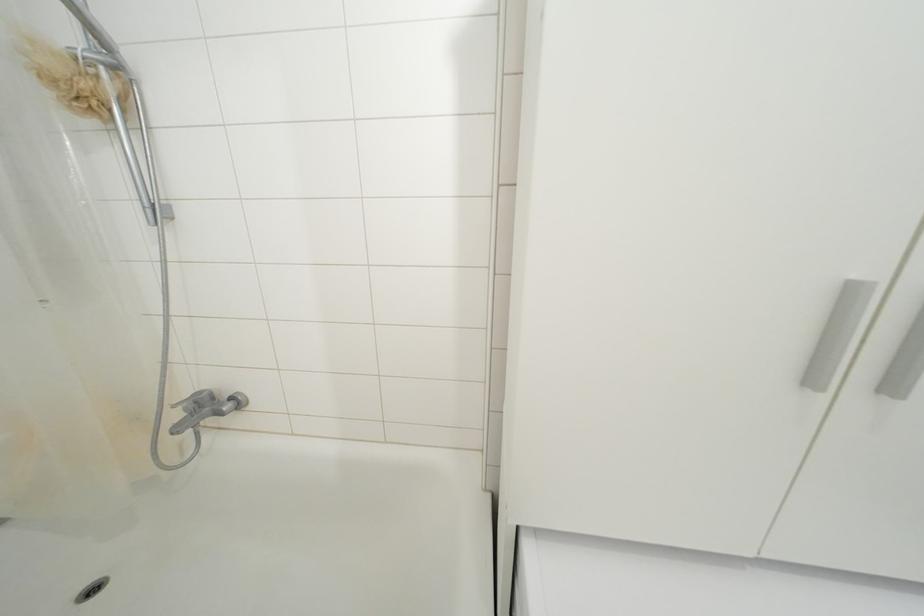
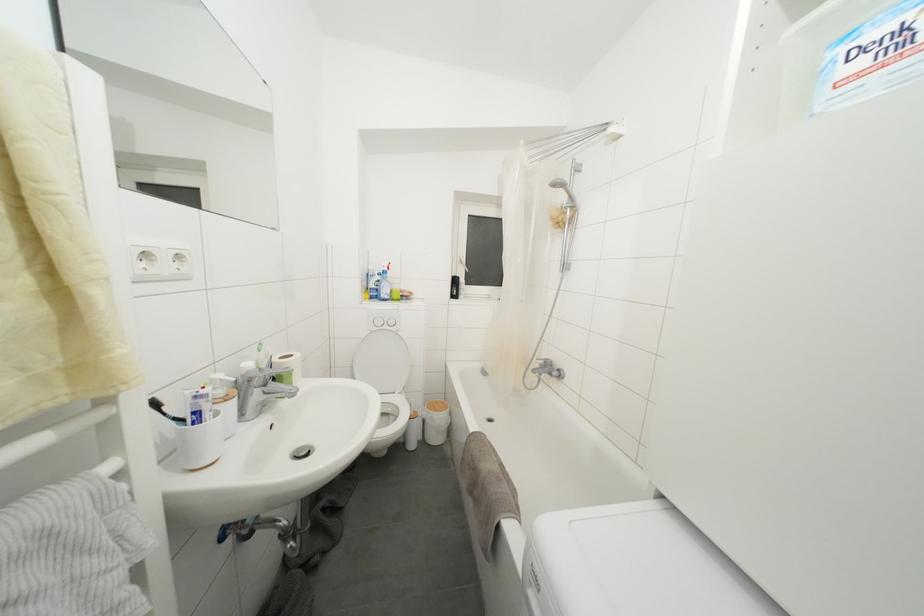
Locate, in the second image, the point that corresponds to point 95,34 in the first image.

(575, 200)